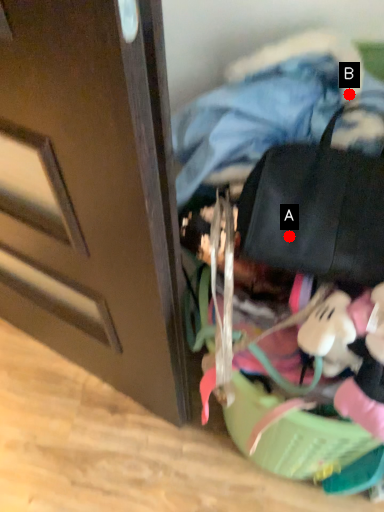
Question: Two points are circled on the image, labeled by A and B beside each circle. Which point is closer to the camera?

Choices:
 (A) A is closer
 (B) B is closer

Answer: (A)